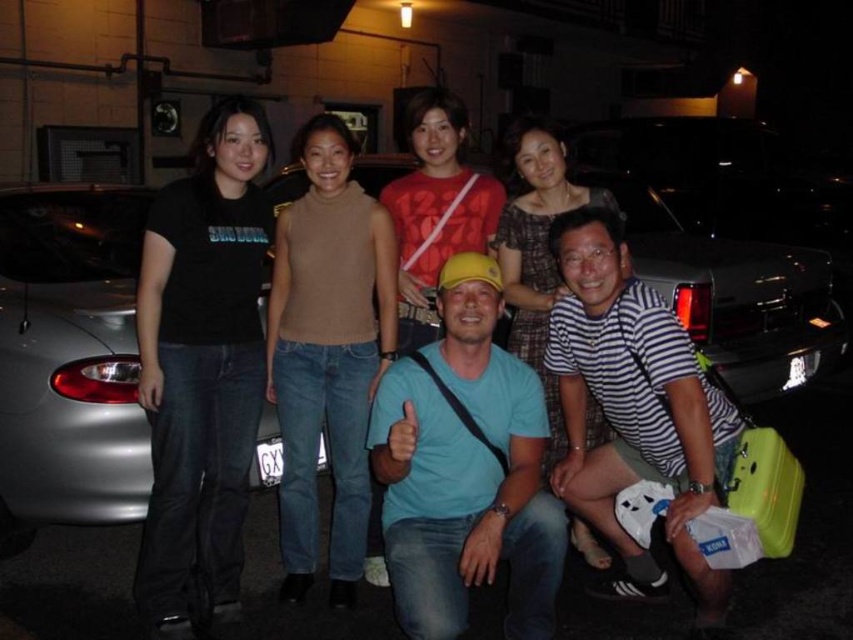
You are organizing a car show and need to place a knit beige sweater at center on top of the silver metallic car at left. Will the sweater fit entirely on the car?

The silver metallic car at left is larger in size than knit beige sweater at center, so the sweater will fit entirely on the car.